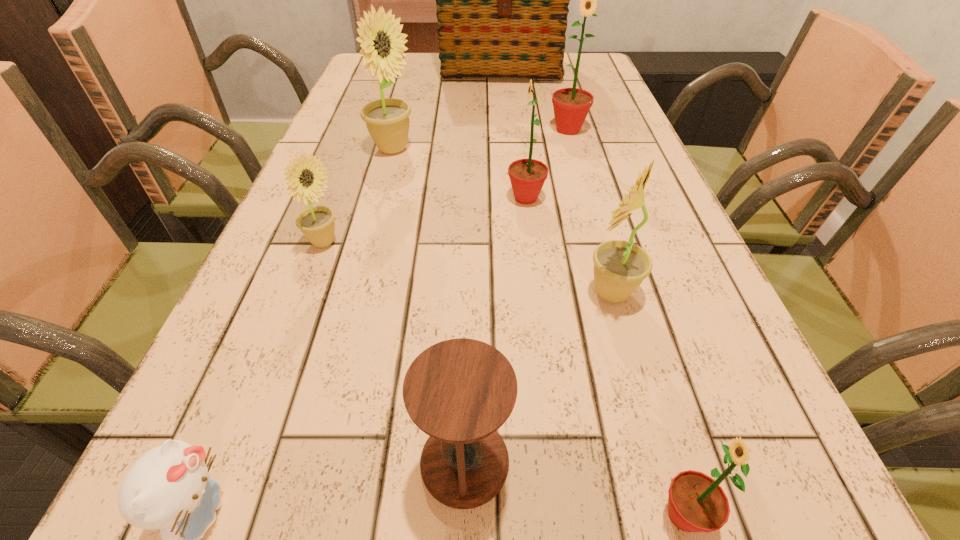
Find the location of a particular element. The height and width of the screenshot is (540, 960). free space between the third farthest sunflower and the biggest green sunflower is located at coordinates (547, 164).

I want to click on vacant space in between the hourglass and the second smallest green sunflower, so click(x=495, y=330).

Locate an element on the screen. This screenshot has width=960, height=540. free space between the hourglass and the biggest yellow sunflower is located at coordinates (428, 305).

You are a GUI agent. You are given a task and a screenshot of the screen. Output one action in this format:
    pyautogui.click(x=<x>, y=<y>)
    Task: Click on the object that can be found as the sixth closest to the fourth farthest sunflower
    
    Given the screenshot: What is the action you would take?
    click(571, 105)

Identify which object is the fifth closest to the kitten. Please provide its 2D coordinates. Your answer should be formatted as a tuple, i.e. [(x, y)], where the tuple contains the x and y coordinates of a point satisfying the conditions above.

[(527, 176)]

Choose which sunflower is the nearest neighbor to the second nearest yellow sunflower. Please provide its 2D coordinates. Your answer should be formatted as a tuple, i.e. [(x, y)], where the tuple contains the x and y coordinates of a point satisfying the conditions above.

[(387, 120)]

Point out which sunflower is positioned as the fourth nearest to the nearest sunflower. Please provide its 2D coordinates. Your answer should be formatted as a tuple, i.e. [(x, y)], where the tuple contains the x and y coordinates of a point satisfying the conditions above.

[(387, 120)]

You are a GUI agent. You are given a task and a screenshot of the screen. Output one action in this format:
    pyautogui.click(x=<x>, y=<y>)
    Task: Click on the yellow sunflower that stands as the third closest to the nearest sunflower
    
    Given the screenshot: What is the action you would take?
    pyautogui.click(x=387, y=120)

Point out which yellow sunflower is positioned as the second nearest to the shopping bag. Please provide its 2D coordinates. Your answer should be formatted as a tuple, i.e. [(x, y)], where the tuple contains the x and y coordinates of a point satisfying the conditions above.

[(317, 224)]

Identify the location of the second closest green sunflower to the farthest yellow sunflower. The image size is (960, 540). (571, 105).